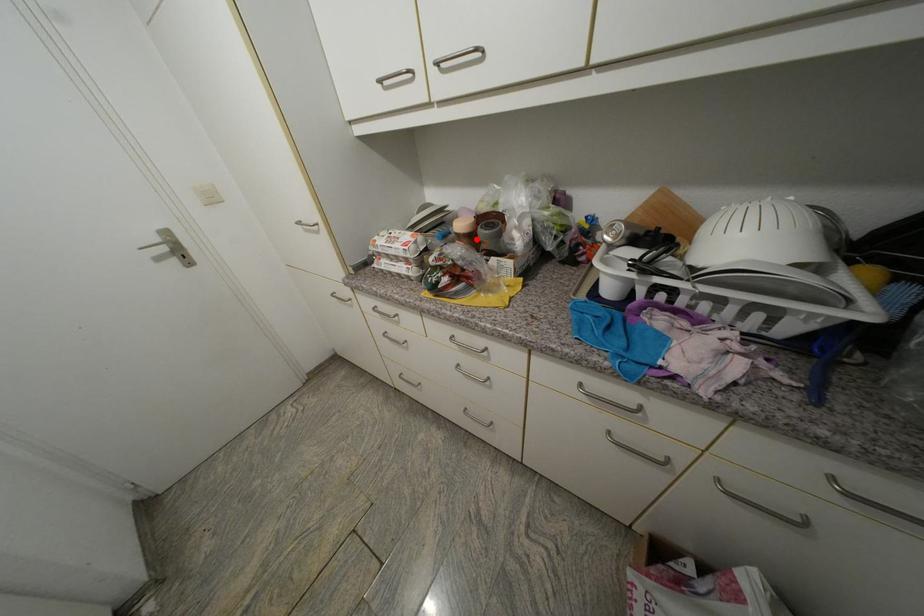
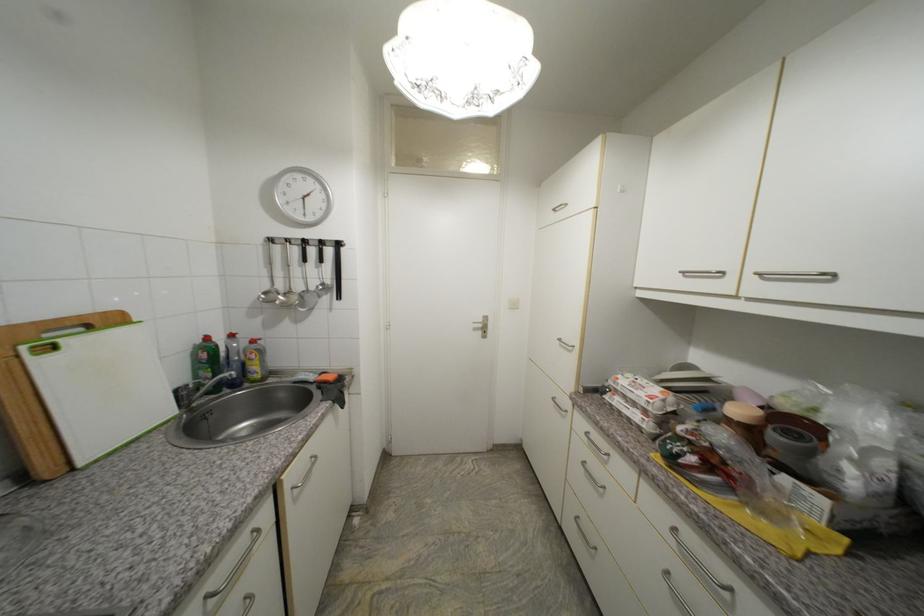
Where in the second image is the point corresponding to the highlighted location from the first image?

(756, 432)